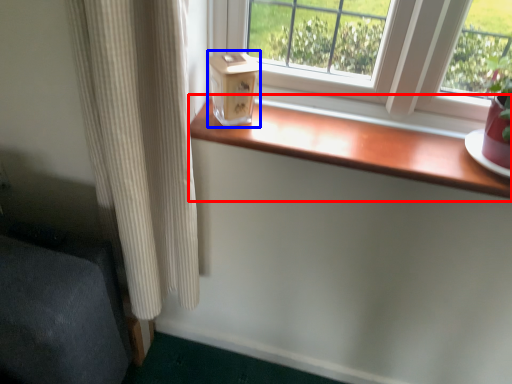
Question: Among these objects, which one is nearest to the camera, window sill (highlighted by a red box) or window box (highlighted by a blue box)?

Choices:
 (A) window sill
 (B) window box

Answer: (A)